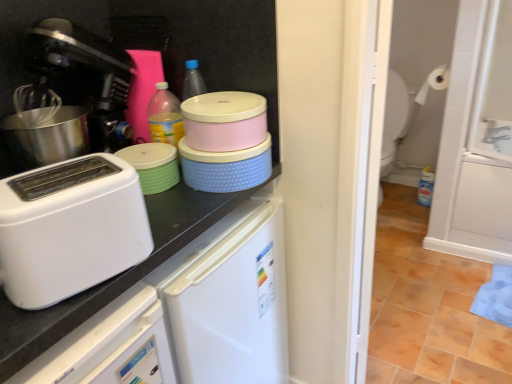
Question: From the image's perspective, relative to white matte toilet paper at upper right, is black plastic coffee machine at left above or below?

Choices:
 (A) above
 (B) below

Answer: (B)

Question: Does point (47, 69) appear closer or farther from the camera than point (422, 99)?

Choices:
 (A) closer
 (B) farther

Answer: (A)

Question: Which object is positioned farthest from the blue glossy bottle at lower right?

Choices:
 (A) white matte toilet paper at upper right
 (B) green matte container at center
 (C) white plastic toaster at left
 (D) white glossy screen door at right
 (E) white matte countertop at upper left

Answer: (C)

Question: Considering the real-world distances, which object is closest to the white glossy screen door at right?

Choices:
 (A) green matte container at center
 (B) white plastic toaster at left
 (C) white matte countertop at upper left
 (D) black plastic coffee machine at left
 (E) white matte toilet paper at upper right

Answer: (E)